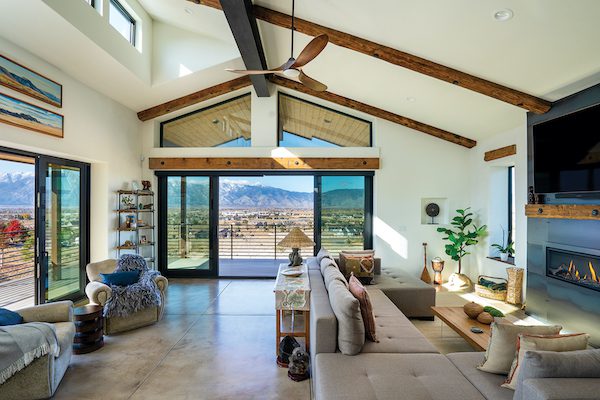
What are the coordinates of `fan in the back on the right in the wall` in the screenshot? It's located at (434, 210).